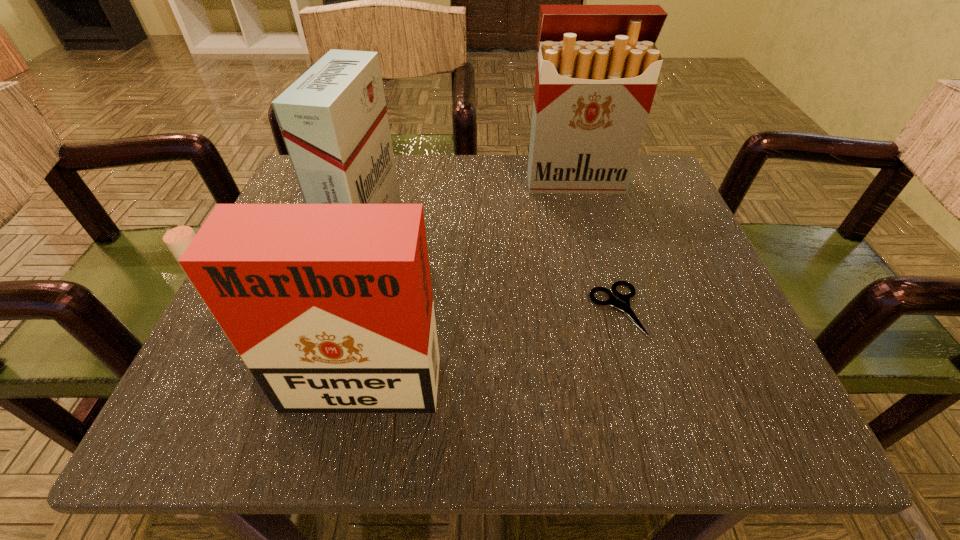
Image resolution: width=960 pixels, height=540 pixels. I want to click on the farthest object, so click(597, 68).

The height and width of the screenshot is (540, 960). I want to click on the rightmost cigarette case, so click(597, 68).

At what (x,y) coordinates should I click in order to perform the action: click on the third nearest object. Please return your answer as a coordinate pair (x, y). This screenshot has width=960, height=540. Looking at the image, I should click on (333, 119).

Find the location of a particular element. The image size is (960, 540). the nearest cigarette case is located at coordinates (330, 307).

I want to click on the third farthest object, so click(622, 301).

Where is `the shortest object`? the shortest object is located at coordinates (622, 301).

This screenshot has width=960, height=540. In order to click on free space located with the lid open on the rightmost cigarette case in this screenshot , I will do `click(597, 267)`.

Where is `free region located on the left of the second nearest cigarette case`? The image size is (960, 540). free region located on the left of the second nearest cigarette case is located at coordinates (304, 232).

What are the coordinates of `free point located 0.190m on the back of the shears` in the screenshot? It's located at (588, 211).

Locate an element on the screen. object that is at the near edge is located at coordinates (330, 307).